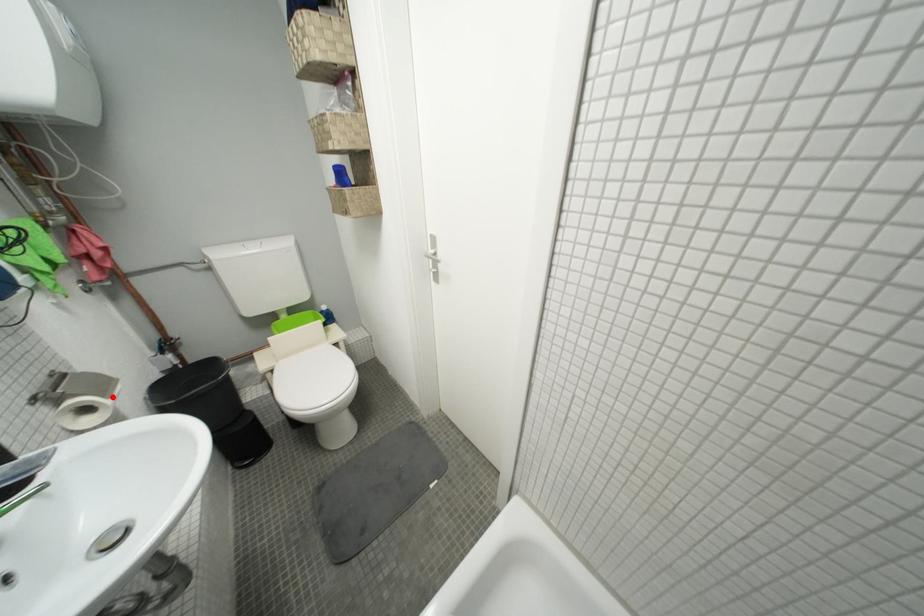
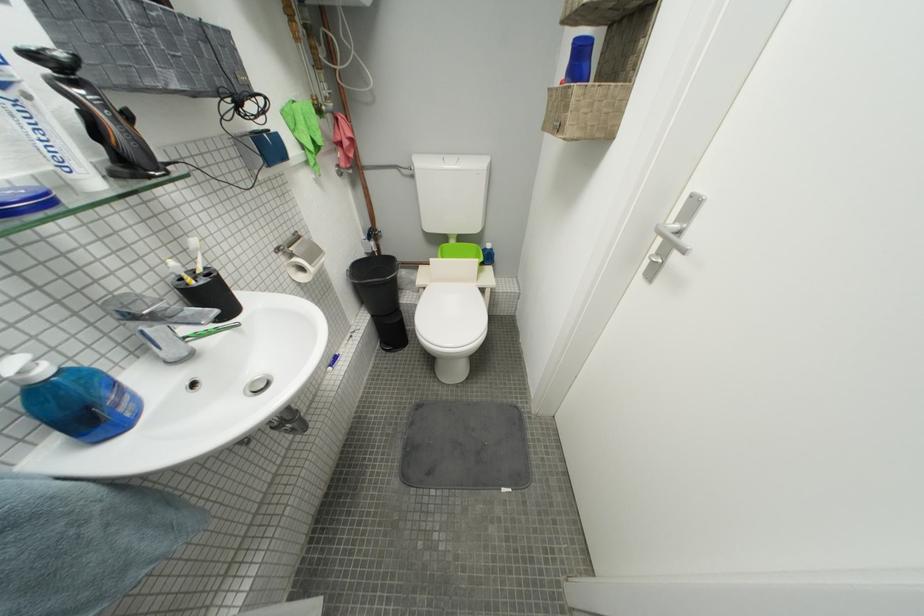
Question: I am providing you with two images of the same scene from different viewpoints. Image1 has a red point marked. In image2, the corresponding 3D location appears at what relative position? Reply with the corresponding letter.

Choices:
 (A) Closer
 (B) Farther

Answer: (A)